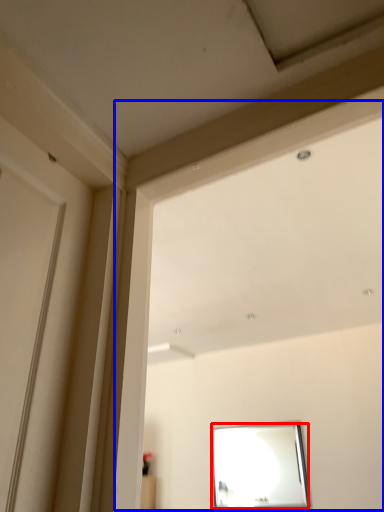
Question: Which point is closer to the camera, mirror (highlighted by a red box) or window frame (highlighted by a blue box)?

Choices:
 (A) mirror
 (B) window frame

Answer: (B)